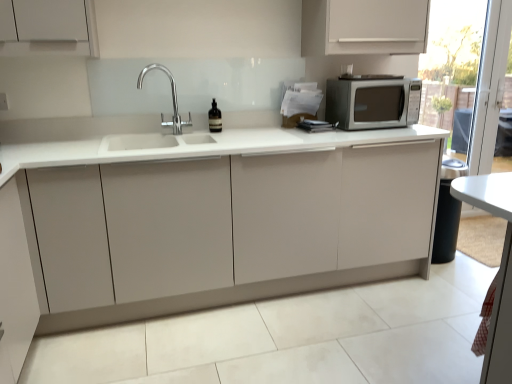
Question: Considering their positions, is white glossy table at lower right located in front of or behind chrome/metallic faucet at center?

Choices:
 (A) front
 (B) behind

Answer: (A)

Question: From the image's perspective, is white glossy table at lower right above or below chrome/metallic faucet at center?

Choices:
 (A) above
 (B) below

Answer: (B)

Question: Which is nearer to the chrome/metallic faucet at center?

Choices:
 (A) white glossy table at lower right
 (B) brown glass bottle at center
 (C) satin silver microwave at upper right
 (D) matte white cabinet at center
 (E) transparent glass screen door at right

Answer: (B)

Question: Considering the real-world distances, which object is closest to the chrome/metallic faucet at center?

Choices:
 (A) transparent glass screen door at right
 (B) white glossy table at lower right
 (C) brown glass bottle at center
 (D) matte white cabinet at center
 (E) satin silver microwave at upper right

Answer: (C)